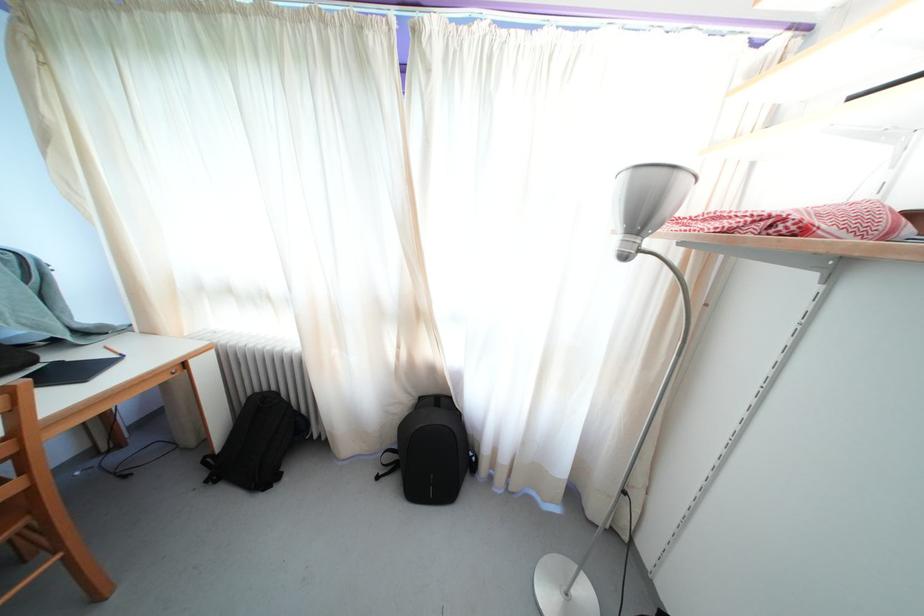
The image size is (924, 616). I want to click on silver lamp head, so click(647, 201).